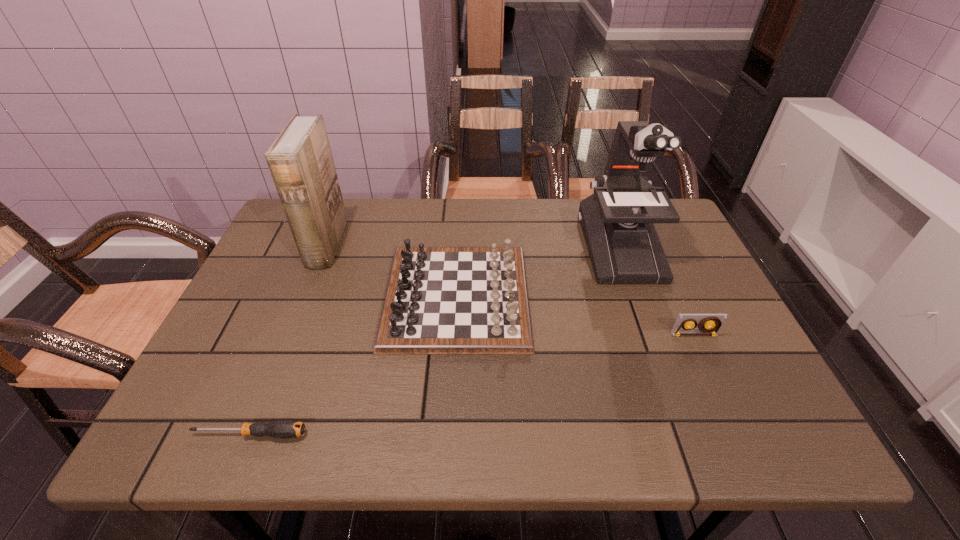
I want to click on blank area located at the front of the fourth tallest object with visible reels, so click(717, 386).

Where is `vacant space situated on the right of the nearest object`? vacant space situated on the right of the nearest object is located at coordinates (344, 434).

Locate an element on the screen. The width and height of the screenshot is (960, 540). microscope located at the far edge is located at coordinates (617, 220).

You are a GUI agent. You are given a task and a screenshot of the screen. Output one action in this format:
    pyautogui.click(x=<x>, y=<y>)
    Task: Click on the phonebook that is at the far edge
    
    Given the screenshot: What is the action you would take?
    pyautogui.click(x=300, y=161)

The image size is (960, 540). What are the coordinates of `object that is positioned at the near edge` in the screenshot? It's located at (283, 429).

This screenshot has height=540, width=960. What are the coordinates of `phonebook at the left edge` in the screenshot? It's located at (300, 161).

In order to click on screwdriver that is at the left edge in this screenshot , I will do `click(283, 429)`.

Identify the location of microscope that is at the right edge. (617, 220).

Where is `videotape that is at the right edge`? The width and height of the screenshot is (960, 540). videotape that is at the right edge is located at coordinates (x=710, y=324).

This screenshot has height=540, width=960. I want to click on object at the far left corner, so click(300, 161).